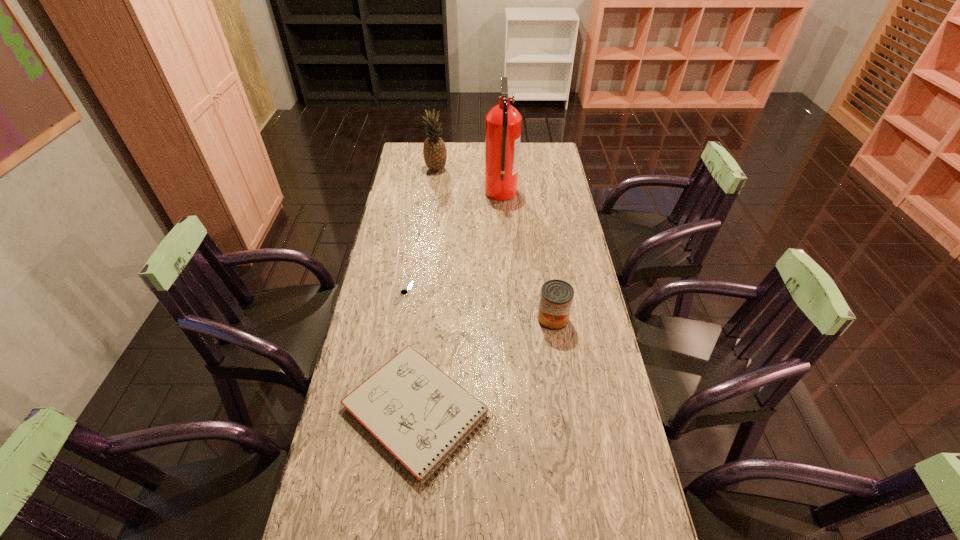
What are the coordinates of `free point between the third farthest object and the fourth farthest object` in the screenshot? It's located at (479, 306).

Where is `free space that is in between the pineapple and the rightmost object`? Image resolution: width=960 pixels, height=540 pixels. free space that is in between the pineapple and the rightmost object is located at coordinates (494, 244).

Find the location of `object that stands as the third closest to the second tallest object`. object that stands as the third closest to the second tallest object is located at coordinates (556, 297).

In order to click on object that is the fourth nearest to the notepad in this screenshot , I will do `click(434, 150)`.

This screenshot has height=540, width=960. Identify the location of free space that satisfies the following two spatial constraints: 1. at the nozzle of the fire extinguisher; 2. on the back side of the rightmost object. (508, 319).

The width and height of the screenshot is (960, 540). Find the location of `vacant point that satisfies the following two spatial constraints: 1. at the nozzle of the third tallest object; 2. on the right side of the fourth nearest object`. vacant point that satisfies the following two spatial constraints: 1. at the nozzle of the third tallest object; 2. on the right side of the fourth nearest object is located at coordinates (508, 319).